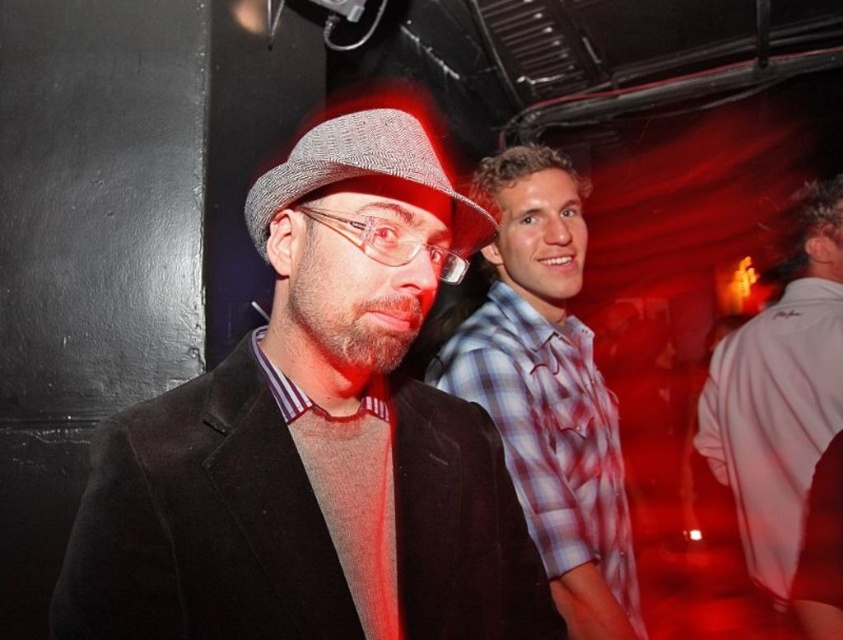
Which of these two, plaid cotton shirt at center or white cotton shirt at right, stands taller?

Standing taller between the two is white cotton shirt at right.

Is plaid cotton shirt at center wider than white cotton shirt at right?

Indeed, plaid cotton shirt at center has a greater width compared to white cotton shirt at right.

Find the location of a particular element. The image size is (843, 640). plaid cotton shirt at center is located at coordinates (545, 387).

Is white cotton shirt at right below herringbone fabric fedora at center?

Yes.

Does white cotton shirt at right have a greater height compared to herringbone fabric fedora at center?

Correct, white cotton shirt at right is much taller as herringbone fabric fedora at center.

Is point (798, 314) in front of point (450, 189)?

No, it is behind (450, 189).

This screenshot has height=640, width=843. Find the location of `white cotton shirt at right`. white cotton shirt at right is located at coordinates (782, 413).

Which is below, plaid cotton shirt at center or herringbone fabric fedora at center?

plaid cotton shirt at center is lower down.

Is plaid cotton shirt at center to the left of herringbone fabric fedora at center from the viewer's perspective?

No, plaid cotton shirt at center is not to the left of herringbone fabric fedora at center.

Image resolution: width=843 pixels, height=640 pixels. Identify the location of plaid cotton shirt at center. (545, 387).

You are a GUI agent. You are given a task and a screenshot of the screen. Output one action in this format:
    pyautogui.click(x=<x>, y=<y>)
    Task: Click on the plaid cotton shirt at center
    Image resolution: width=843 pixels, height=640 pixels.
    Given the screenshot: What is the action you would take?
    pyautogui.click(x=545, y=387)